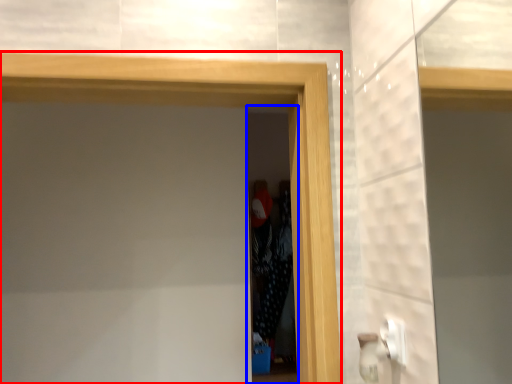
Question: Which object is closer to the camera taking this photo, screen door (highlighted by a red box) or screen door (highlighted by a blue box)?

Choices:
 (A) screen door
 (B) screen door

Answer: (A)